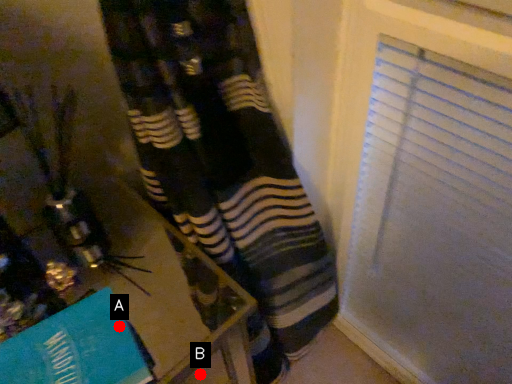
Question: Two points are circled on the image, labeled by A and B beside each circle. Which point appears closest to the camera in this image?

Choices:
 (A) A is closer
 (B) B is closer

Answer: (A)